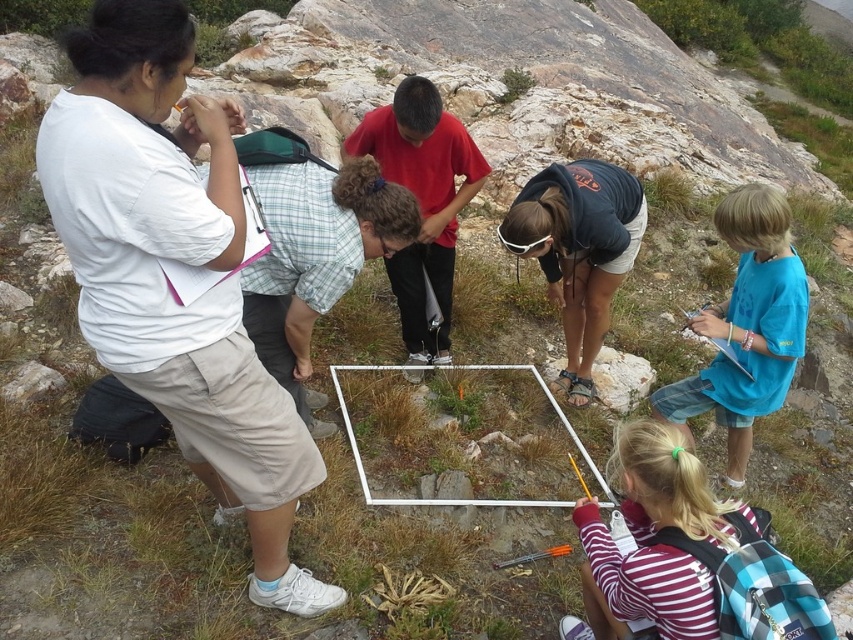
Question: Based on their relative distances, which object is farther from the gray rock at center?

Choices:
 (A) black fabric shirt at center
 (B) white cotton shirt at upper left

Answer: (B)

Question: Is white cotton shirt at upper left below blue t-shirt at lower right?

Choices:
 (A) yes
 (B) no

Answer: (B)

Question: Considering the relative positions of blue t-shirt at lower right and gray rock at center in the image provided, where is blue t-shirt at lower right located with respect to gray rock at center?

Choices:
 (A) above
 (B) below

Answer: (A)

Question: Is white cotton shirt at upper left above black fabric shirt at center?

Choices:
 (A) yes
 (B) no

Answer: (B)

Question: Considering the real-world distances, which object is farthest from the blue t-shirt at lower right?

Choices:
 (A) gray rock at center
 (B) black fabric shirt at center
 (C) white cotton shirt at upper left

Answer: (C)

Question: Which point is closer to the camera?

Choices:
 (A) gray rock at center
 (B) white cotton shirt at upper left
 (C) blue t-shirt at lower right

Answer: (B)